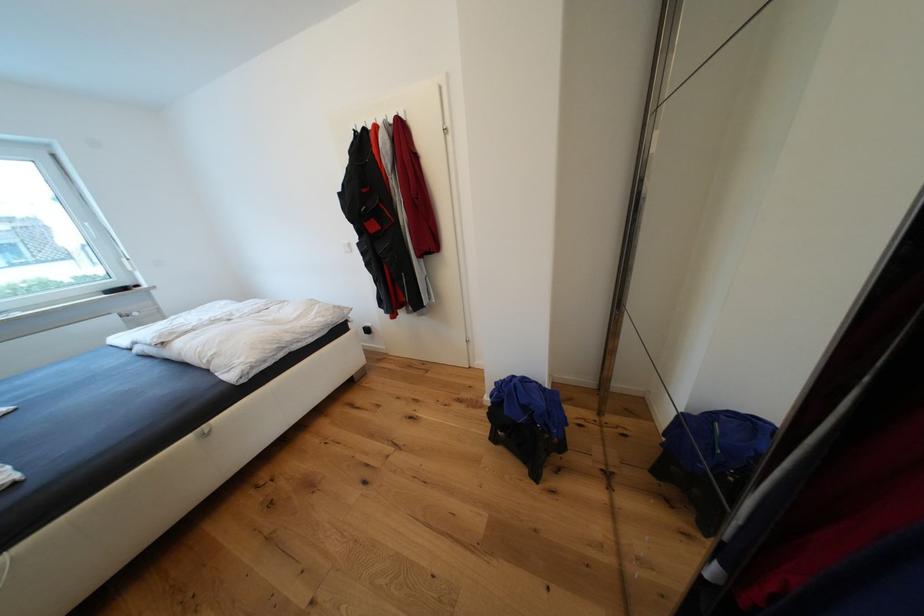
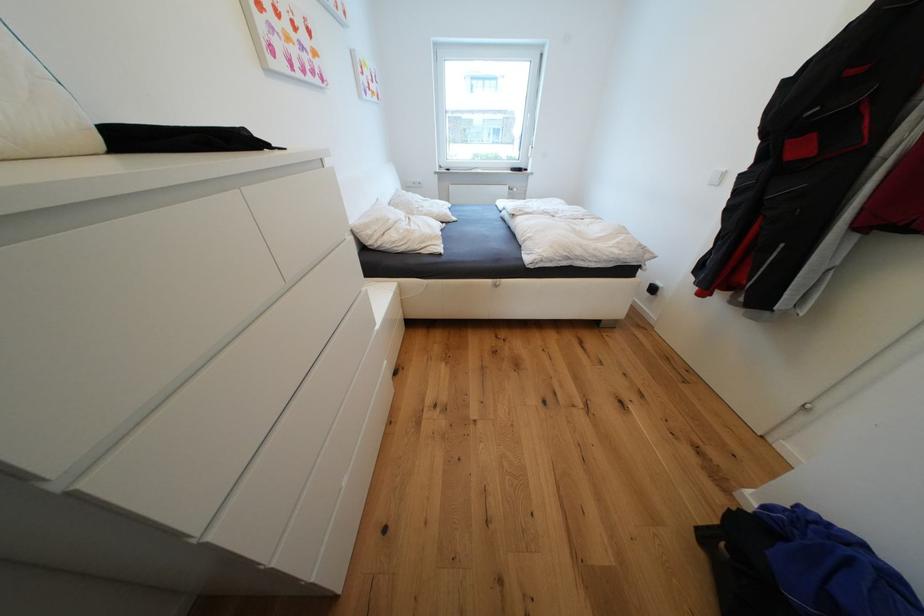
Locate, in the second image, the point that corresponds to point (179, 334) in the first image.

(528, 212)